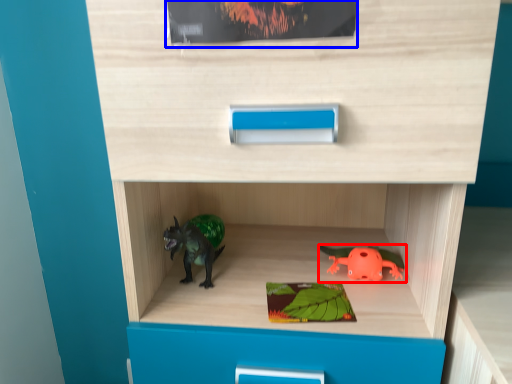
Question: Which object is closer to the camera taking this photo, toy (highlighted by a red box) or paperback book (highlighted by a blue box)?

Choices:
 (A) toy
 (B) paperback book

Answer: (B)